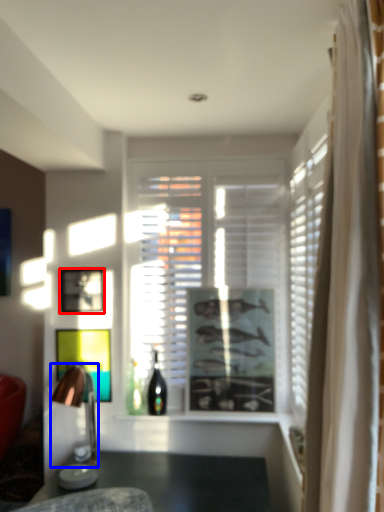
Question: Which object is further to the camera taking this photo, picture frame (highlighted by a red box) or lamp (highlighted by a blue box)?

Choices:
 (A) picture frame
 (B) lamp

Answer: (A)